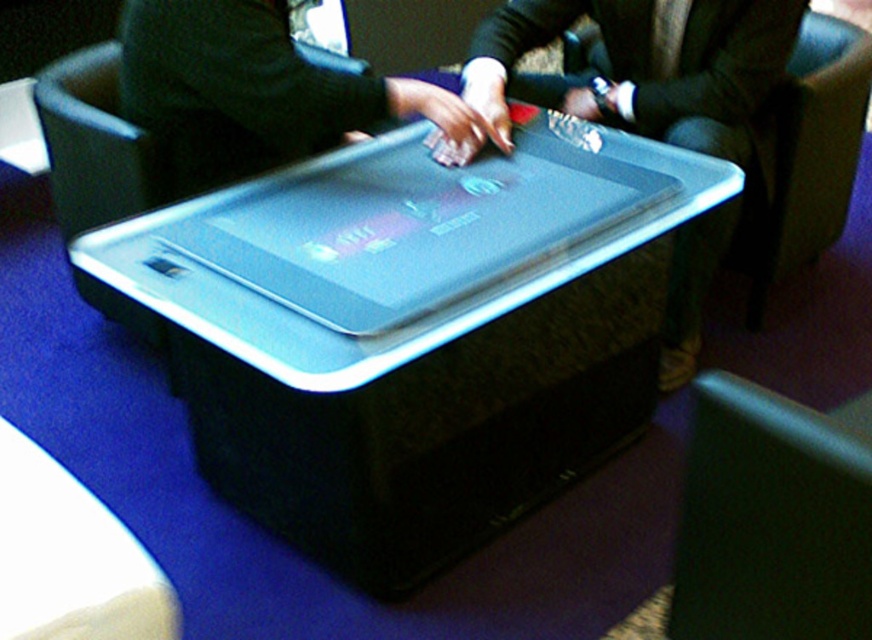
Does clear plastic tray at center appear over smooth leather armchair at lower right?

Indeed, clear plastic tray at center is positioned over smooth leather armchair at lower right.

Between clear plastic tray at center and smooth leather armchair at lower right, which one appears on the right side from the viewer's perspective?

smooth leather armchair at lower right is more to the right.

Who is more forward, (489, 374) or (707, 426)?

Point (707, 426)

Locate an element on the screen. This screenshot has width=872, height=640. clear plastic tray at center is located at coordinates (410, 401).

Is clear plastic tray at center to the left of dark green fabric armchair at right from the viewer's perspective?

Correct, you'll find clear plastic tray at center to the left of dark green fabric armchair at right.

Is the position of clear plastic tray at center less distant than that of dark green fabric armchair at right?

That is True.

This screenshot has width=872, height=640. What do you see at coordinates (410, 401) in the screenshot?
I see `clear plastic tray at center` at bounding box center [410, 401].

Identify the location of clear plastic tray at center. (410, 401).

Which of these two, smooth leather armchair at lower right or dark green fabric armchair at right, stands taller?

dark green fabric armchair at right

What are the coordinates of `smooth leather armchair at lower right` in the screenshot? It's located at (772, 516).

Between point (693, 513) and point (805, 76), which one is positioned in front?

Positioned in front is point (693, 513).

Locate an element on the screen. smooth leather armchair at lower right is located at coordinates (772, 516).